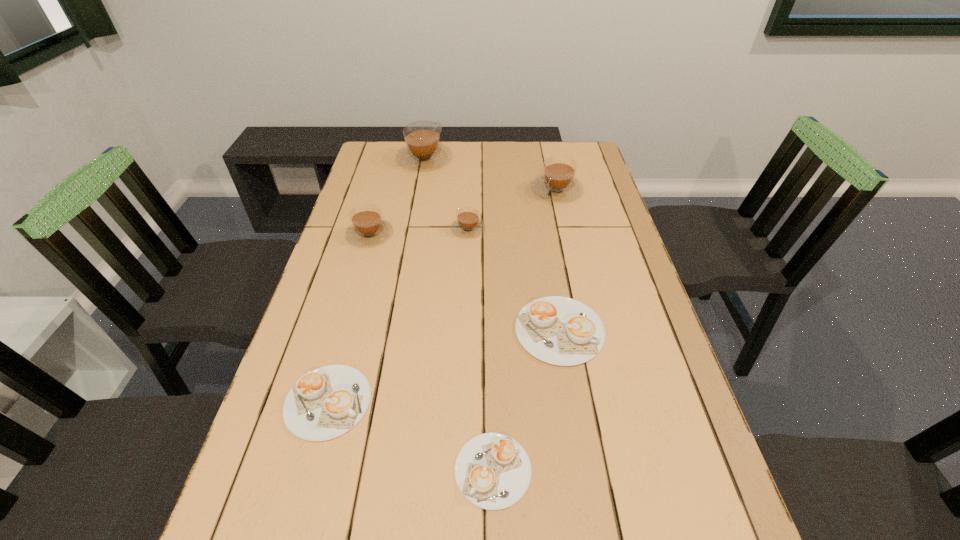
Identify the location of vacant region located on the back of the shortest object. (490, 326).

The image size is (960, 540). I want to click on object that is positioned at the far edge, so click(423, 150).

Where is `object located in the far left corner section of the desktop`? object located in the far left corner section of the desktop is located at coordinates (423, 150).

This screenshot has height=540, width=960. Identify the location of vacant space at the far edge of the desktop. (456, 154).

The width and height of the screenshot is (960, 540). In the image, there is a desktop. In order to click on vacant space at the left edge in this screenshot , I will do `click(359, 185)`.

At what (x,y) coordinates should I click in order to perform the action: click on free space at the right edge of the desktop. Please return your answer as a coordinate pair (x, y). This screenshot has height=540, width=960. Looking at the image, I should click on (625, 260).

At what (x,y) coordinates should I click in order to perform the action: click on vacant point at the far right corner. Please return your answer as a coordinate pair (x, y). This screenshot has width=960, height=540. Looking at the image, I should click on (560, 145).

The image size is (960, 540). I want to click on unoccupied area between the third nearest brown cappuccino and the fifth tallest object, so click(559, 260).

Locate an element on the screen. empty location between the smallest white cappuccino and the third biggest brown cappuccino is located at coordinates (431, 352).

This screenshot has width=960, height=540. What are the coordinates of `free space between the second biggest white cappuccino and the smallest white cappuccino` in the screenshot? It's located at [x=411, y=436].